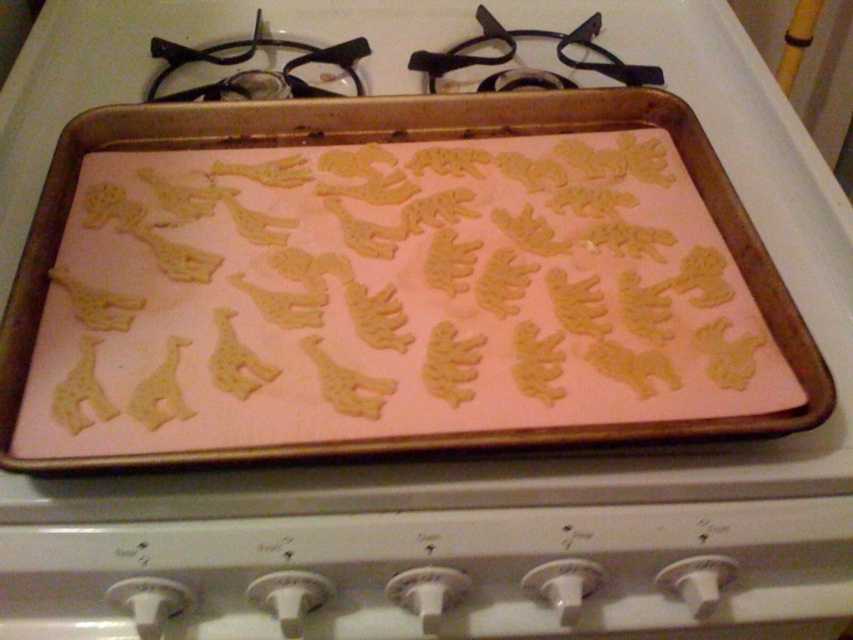
Question: Does golden brown cookie sheet at center appear over black metal gas stove at upper center?

Choices:
 (A) no
 (B) yes

Answer: (A)

Question: Is golden brown cookie sheet at center positioned before black metal gas stove at upper center?

Choices:
 (A) yes
 (B) no

Answer: (A)

Question: Which object appears farthest from the camera in this image?

Choices:
 (A) black metal gas stove at upper center
 (B) golden brown cookie sheet at center

Answer: (A)

Question: Which of the following is the farthest from the observer?

Choices:
 (A) black metal gas stove at upper center
 (B) golden brown cookie sheet at center

Answer: (A)

Question: Does golden brown cookie sheet at center lie behind black metal gas stove at upper center?

Choices:
 (A) yes
 (B) no

Answer: (B)